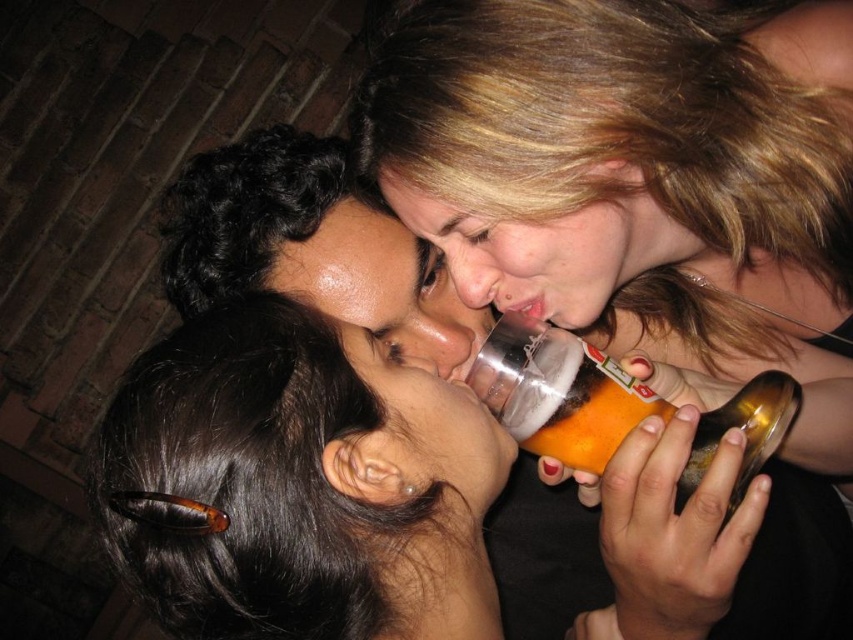
You are at a party and see two bottles, a matte plastic bottle at center and a translucent plastic bottle at center. Which one is taller?

The matte plastic bottle at center is taller than the translucent plastic bottle at center.

You are at a party and see the translucent plastic cup at upper center and the matte plastic bottle at center. Which one has a larger capacity?

The translucent plastic cup at upper center has a larger capacity than the matte plastic bottle at center because it is bigger.

From the picture: You are at a party and need to grab a drink. You see a translucent plastic cup at upper center and a matte plastic bottle at center. Which one is closer to the right side?

The translucent plastic cup at upper center is to the right of the matte plastic bottle at center, so the cup is closer to the right side.